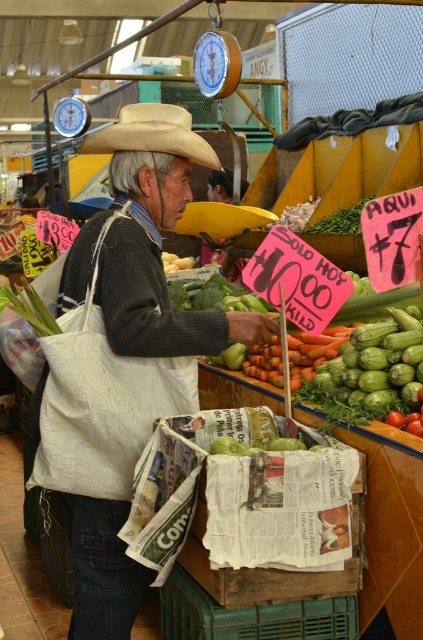
Describe the element at coordinates (151, 134) in the screenshot. The height and width of the screenshot is (640, 423). I see `light brown felt cowboy hat at center` at that location.

Who is more distant from viewer, (187, 131) or (164, 252)?

The point (164, 252) is behind.

Where is `light brown felt cowboy hat at center`? light brown felt cowboy hat at center is located at coordinates (151, 134).

From the picture: Can you confirm if green matte zucchini at center is wider than light brown felt cowboy hat at center?

Incorrect, green matte zucchini at center's width does not surpass light brown felt cowboy hat at center's.

Who is lower down, green matte zucchini at center or light brown felt cowboy hat at center?

Positioned lower is green matte zucchini at center.

Image resolution: width=423 pixels, height=640 pixels. Identify the location of green matte zucchini at center. (373, 372).

In order to click on green matte zucchini at center in this screenshot , I will do `click(373, 372)`.

Between green matte zucchini at center and yellow matte potato at center, which one appears on the right side from the viewer's perspective?

green matte zucchini at center

Is green matte zucchini at center wider than yellow matte potato at center?

Correct, the width of green matte zucchini at center exceeds that of yellow matte potato at center.

Is point (373, 376) farther from camera compared to point (175, 256)?

No, it is not.

The width and height of the screenshot is (423, 640). Find the location of `green matte zucchini at center`. green matte zucchini at center is located at coordinates (373, 372).